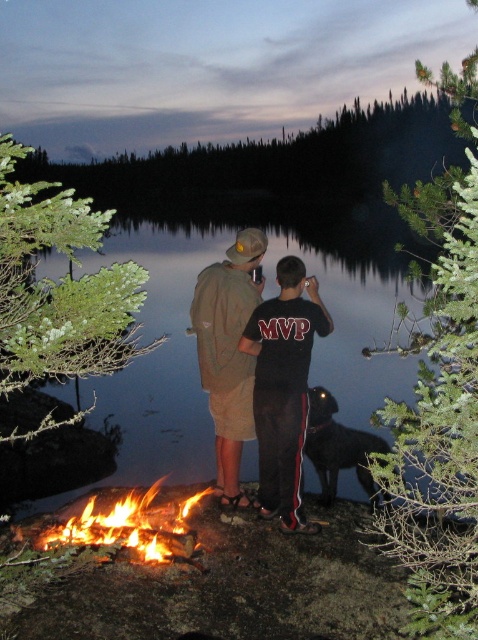
You are standing at the edge of the lake and want to walk towards the shiny black dog at lower center. Will you step on the glossy reflective water at center before reaching the dog?

The glossy reflective water at center is in front of the shiny black dog at lower center, so stepping towards the dog would require walking over the water first before reaching the dog.

You are planning to take a photo of the khaki cotton shorts at center and the flaming wood fire at lower left. Which object should you focus on first if you want to capture both in the same frame without moving the camera?

You should focus on the khaki cotton shorts at center first because it is located above the flaming wood fire at lower left, so adjusting focus to the higher object ensures both are in the frame.